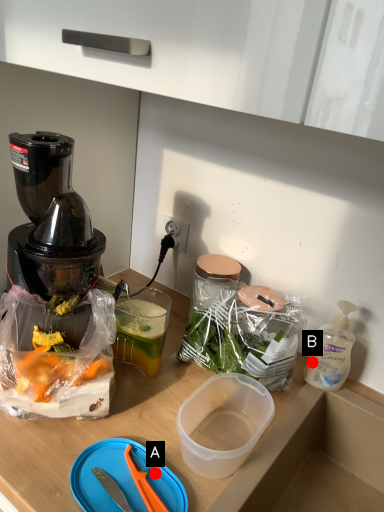
Question: Two points are circled on the image, labeled by A and B beside each circle. Which point is closer to the camera?

Choices:
 (A) A is closer
 (B) B is closer

Answer: (A)